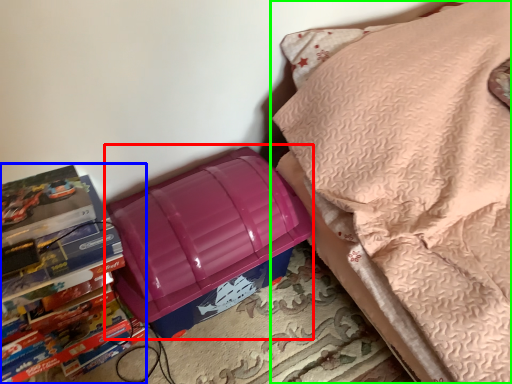
Question: Based on their relative distances, which object is nearer to lunch box (highlighted by a red box)? Choose from book (highlighted by a blue box) and furniture (highlighted by a green box).

Choices:
 (A) book
 (B) furniture

Answer: (A)